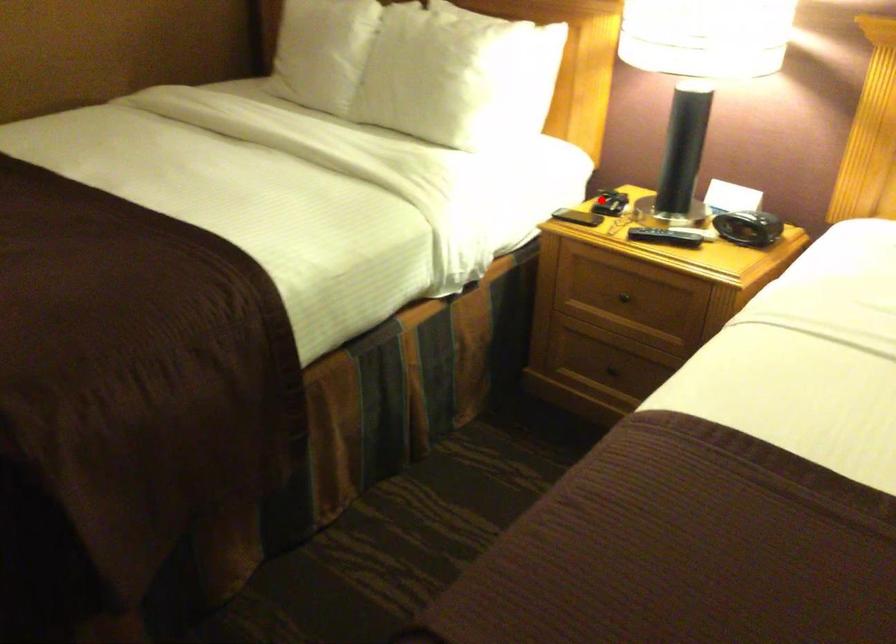
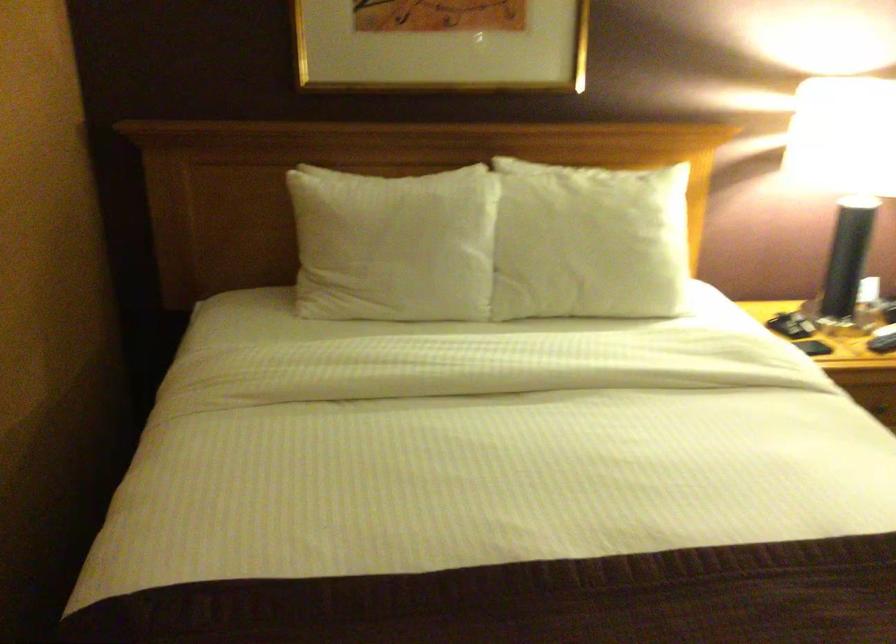
In the second image, find the point that corresponds to the highlighted location in the first image.

(782, 325)